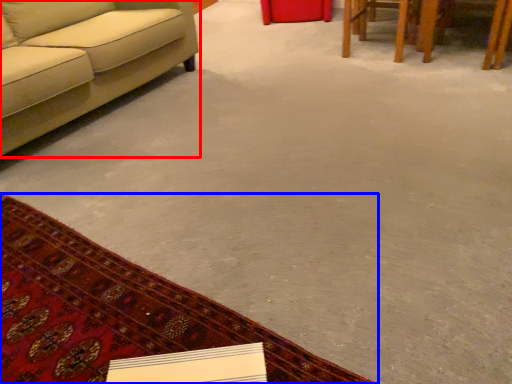
Question: Which of the following is the closest to the observer, studio couch (highlighted by a red box) or mat (highlighted by a blue box)?

Choices:
 (A) studio couch
 (B) mat

Answer: (B)